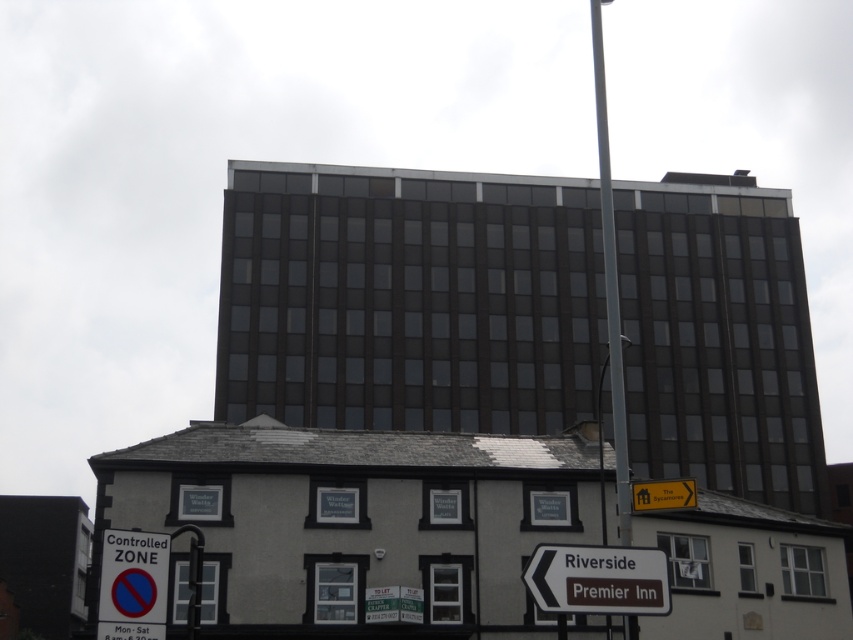
You are a delivery driver who needs to park near the brown matte sign at lower center and the white plastic sign at lower left. According to the controlled zone parking restrictions, which sign is shorter and might be easier to see around when parking?

The brown matte sign at lower center is not as tall as the white plastic sign at lower left, so it is shorter and easier to see around when parking.

You are a delivery driver who needs to locate the brown matte sign at lower center. According to the scene, where would you find it in relation to the traditional building and the modern building?

The brown matte sign at lower center is located at the point closest to the traditional building since its coordinates are closer to the lower part of the image where the traditional building is situated.